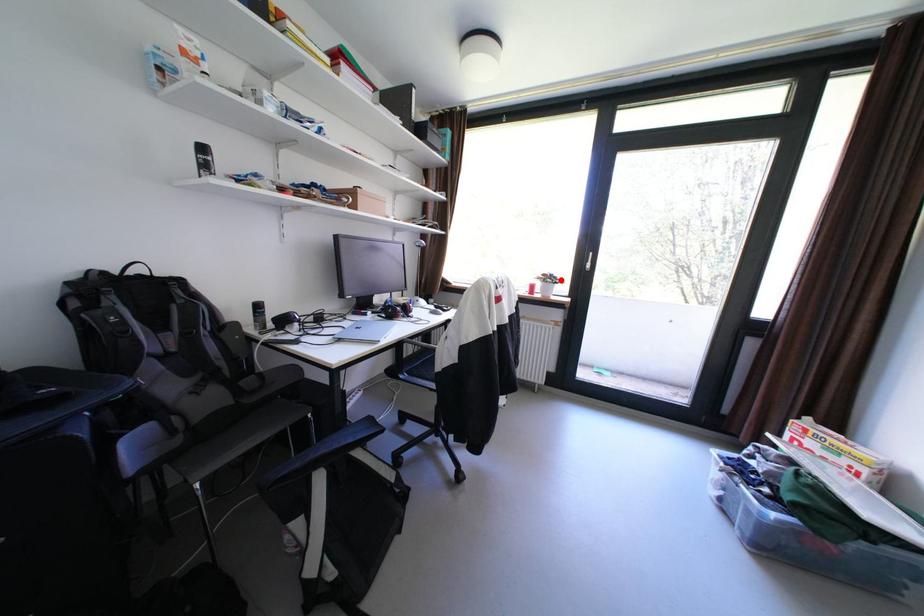
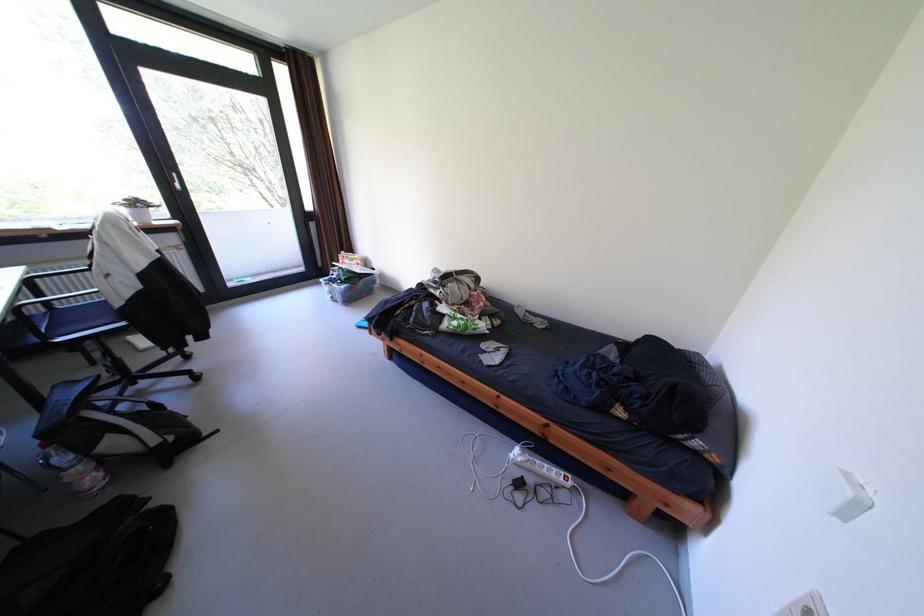
Locate, in the second image, the point that corresponds to the highlighted location in the first image.

(149, 205)